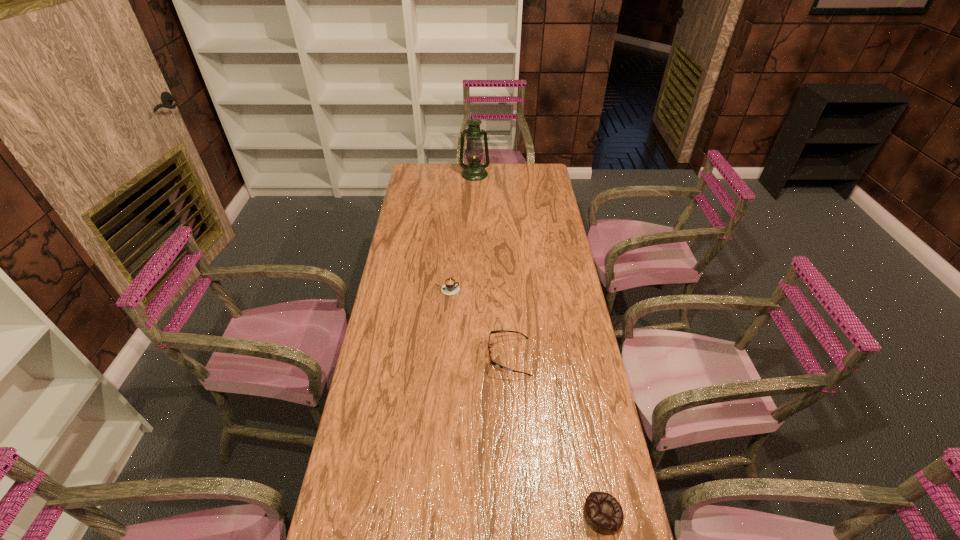
Identify the location of vacant space in between the cappuccino and the nearest object. The width and height of the screenshot is (960, 540). click(x=525, y=402).

You are a GUI agent. You are given a task and a screenshot of the screen. Output one action in this format:
    pyautogui.click(x=<x>, y=<y>)
    Task: Click on the empty location between the tallest object and the sunglasses
    
    Given the screenshot: What is the action you would take?
    pos(492,266)

Image resolution: width=960 pixels, height=540 pixels. Find the location of `unoccupied position between the second tallest object and the rightmost object`. unoccupied position between the second tallest object and the rightmost object is located at coordinates (556, 435).

Where is `vacant area between the second nearest object and the rightmost object`? vacant area between the second nearest object and the rightmost object is located at coordinates 556,435.

You are a GUI agent. You are given a task and a screenshot of the screen. Output one action in this format:
    pyautogui.click(x=<x>, y=<y>)
    Task: Click on the free spot between the beanbag and the cappuccino
    The width and height of the screenshot is (960, 540).
    Given the screenshot: What is the action you would take?
    [x=525, y=402]

The width and height of the screenshot is (960, 540). Identify the location of empty location between the second tallest object and the tallest object. (492, 266).

What are the coordinates of `unoccupied area between the third shortest object and the nearest object` in the screenshot? It's located at (556, 435).

I want to click on vacant space that's between the tallest object and the sunglasses, so click(492, 266).

Locate which object is the closest to the cappuccino. Please provide its 2D coordinates. Your answer should be formatted as a tuple, i.e. [(x, y)], where the tuple contains the x and y coordinates of a point satisfying the conditions above.

[(499, 331)]

What are the coordinates of `the second closest object to the second tallest object` in the screenshot? It's located at (603, 513).